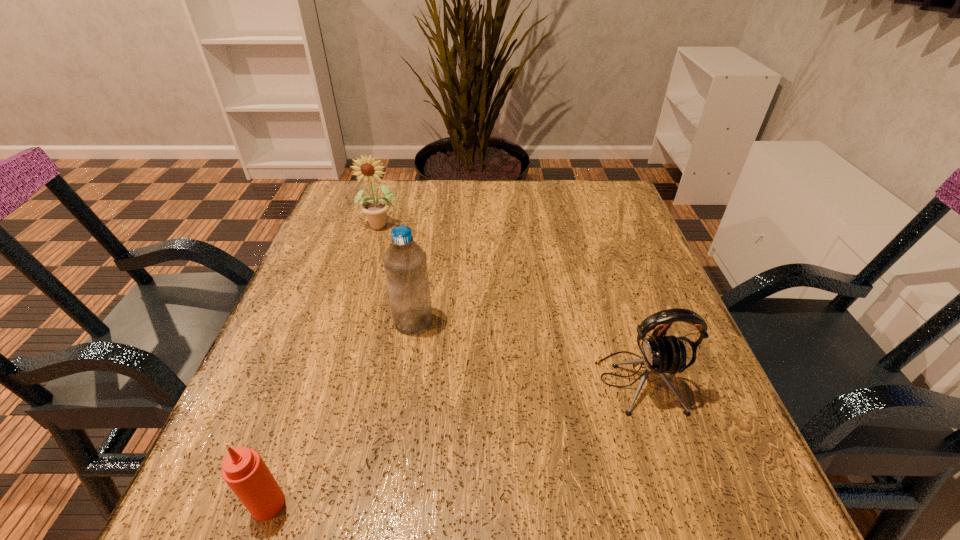
Where is `blank space that satisfies the following two spatial constraints: 1. on the front-facing side of the earphone; 2. on the left side of the farthest object`? The width and height of the screenshot is (960, 540). blank space that satisfies the following two spatial constraints: 1. on the front-facing side of the earphone; 2. on the left side of the farthest object is located at coordinates (335, 382).

This screenshot has height=540, width=960. I want to click on vacant space that satisfies the following two spatial constraints: 1. on the back side of the Tabasco sauce; 2. on the left side of the third farthest object, so click(311, 382).